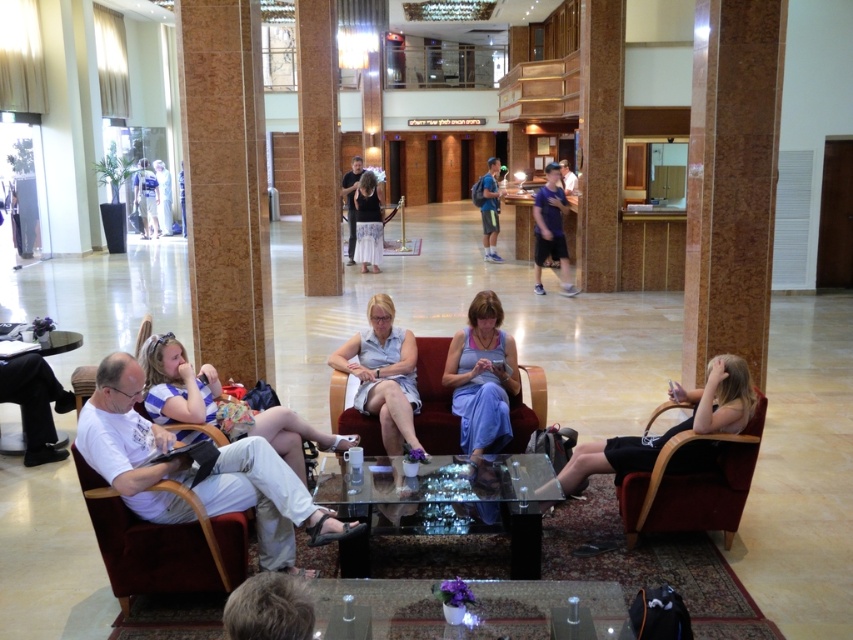
You are standing in the lobby and want to take a photo of both point (553, 177) and point (357, 211). Which point should you focus on first to ensure both are in clear view?

You should focus on point (553, 177) first because it is closer to the camera than point (357, 211), ensuring both points are in focus when using depth of field.